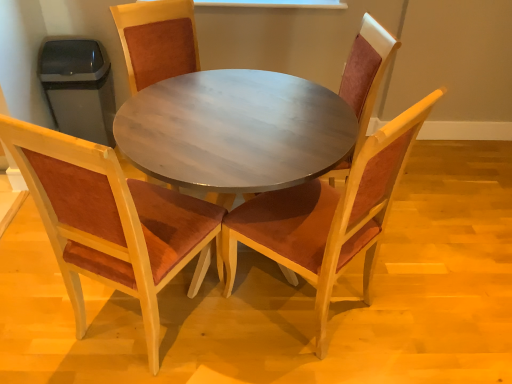
Question: Is wooden chair with brown cushion at center, the 2th chair in the left-to-right sequence, located within velvet burgundy chair at center, which is the first chair in right-to-left order?

Choices:
 (A) yes
 (B) no

Answer: (B)

Question: Is velvet burgundy chair at center, which appears as the fourth chair when viewed from the left, oriented towards wooden chair with brown cushion at center, the 2th chair in the left-to-right sequence?

Choices:
 (A) yes
 (B) no

Answer: (A)

Question: Is velvet burgundy chair at center, which is the first chair in right-to-left order, closer to the viewer compared to wooden chair with brown cushion at center, the 2th chair in the left-to-right sequence?

Choices:
 (A) no
 (B) yes

Answer: (B)

Question: Is velvet burgundy chair at center, which is the first chair in right-to-left order, at the right side of wooden chair with brown cushion at center, the 2th chair in the left-to-right sequence?

Choices:
 (A) no
 (B) yes

Answer: (B)

Question: Is velvet burgundy chair at center, which appears as the fourth chair when viewed from the left, positioned far away from wooden chair with brown cushion at center, acting as the third chair starting from the right?

Choices:
 (A) yes
 (B) no

Answer: (B)

Question: Is wooden chair with brown cushion at center, the 2th chair in the left-to-right sequence, taller or shorter than wooden table at center?

Choices:
 (A) short
 (B) tall

Answer: (A)

Question: From the image's perspective, relative to wooden table at center, is wooden chair with brown cushion at center, the 2th chair in the left-to-right sequence, above or below?

Choices:
 (A) below
 (B) above

Answer: (B)

Question: Is wooden chair with brown cushion at center, acting as the third chair starting from the right, to the left or to the right of wooden table at center in the image?

Choices:
 (A) right
 (B) left

Answer: (B)

Question: Considering their positions, is wooden chair with brown cushion at center, acting as the third chair starting from the right, located in front of or behind wooden table at center?

Choices:
 (A) behind
 (B) front

Answer: (A)

Question: Considering the relative positions of wooden chair with brown cushion at center, the 2th chair in the left-to-right sequence, and velvet red chair at center, which is counted as the second chair, starting from the right, in the image provided, is wooden chair with brown cushion at center, the 2th chair in the left-to-right sequence, to the left or to the right of velvet red chair at center, which is counted as the second chair, starting from the right,?

Choices:
 (A) right
 (B) left

Answer: (B)

Question: Is wooden chair with brown cushion at center, the 2th chair in the left-to-right sequence, in front of or behind velvet red chair at center, which is counted as the second chair, starting from the right, in the image?

Choices:
 (A) front
 (B) behind

Answer: (B)

Question: From the image's perspective, is wooden chair with brown cushion at center, acting as the third chair starting from the right, above or below velvet red chair at center, which is counted as the second chair, starting from the right?

Choices:
 (A) above
 (B) below

Answer: (A)

Question: Based on their sizes in the image, would you say wooden chair with brown cushion at center, acting as the third chair starting from the right, is bigger or smaller than velvet red chair at center, which is counted as the second chair, starting from the right?

Choices:
 (A) small
 (B) big

Answer: (A)

Question: In the image, is velvet red chair at center, the third chair when ordered from left to right, on the left side or the right side of velvet burgundy chair at center, which appears as the fourth chair when viewed from the left?

Choices:
 (A) left
 (B) right

Answer: (A)

Question: Considering their positions, is velvet red chair at center, which is counted as the second chair, starting from the right, located in front of or behind velvet burgundy chair at center, which appears as the fourth chair when viewed from the left?

Choices:
 (A) behind
 (B) front

Answer: (B)